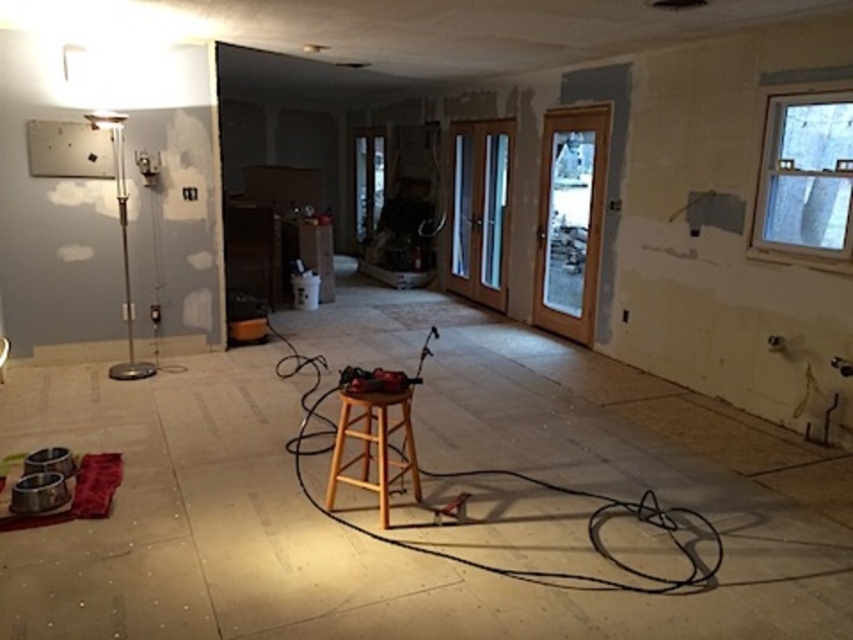
Question: Is black cable at center thinner than wooden bar stool at center?

Choices:
 (A) no
 (B) yes

Answer: (A)

Question: Which point appears closest to the camera in this image?

Choices:
 (A) (326, 502)
 (B) (589, 538)

Answer: (B)

Question: Is black cable at center bigger than wooden bar stool at center?

Choices:
 (A) yes
 (B) no

Answer: (A)

Question: Which point appears closest to the camera in this image?

Choices:
 (A) click(x=596, y=577)
 (B) click(x=347, y=416)

Answer: (A)

Question: Is black cable at center behind wooden bar stool at center?

Choices:
 (A) no
 (B) yes

Answer: (B)